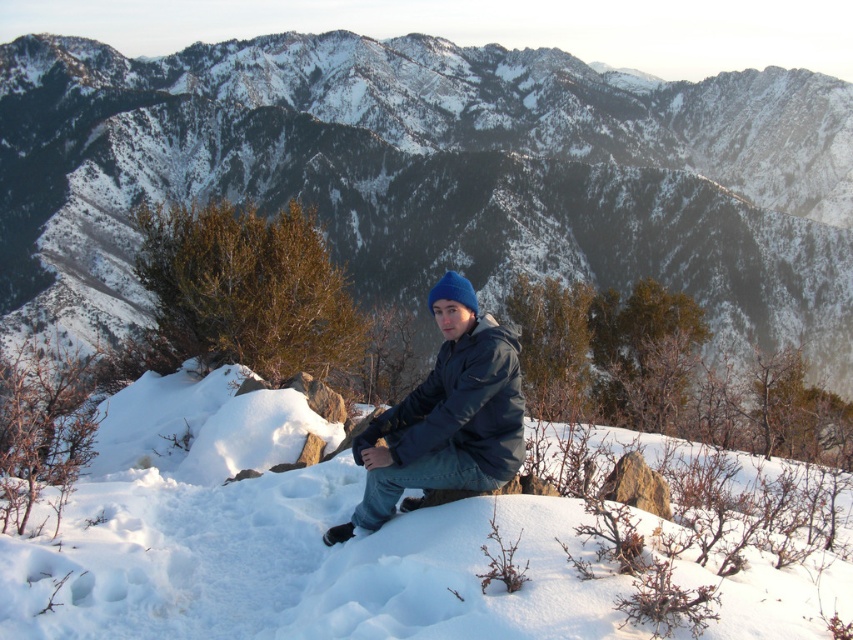
You are standing in the winter landscape and want to place a small flag at one of the two points, point (202, 176) or point (229, 435). Which point is closer to you so that the flag will be more visible?

Point (202, 176) is further to the viewer than point (229, 435), so placing the flag at point (202, 176) will make it more visible since it is closer to you.

You are planning to take a photo of the snowy mountain at center and the blue matte jacket at center. Which object should you focus on first if you want to capture both in a single frame without moving the camera?

The snowy mountain at center is larger in size than the blue matte jacket at center, so you should focus on the snowy mountain at center first to ensure it fits properly in the frame before adjusting for the smaller jacket.